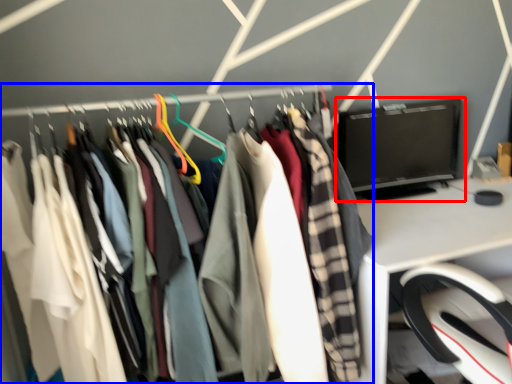
Question: Which object appears farthest to the camera in this image, computer monitor (highlighted by a red box) or closet (highlighted by a blue box)?

Choices:
 (A) computer monitor
 (B) closet

Answer: (A)